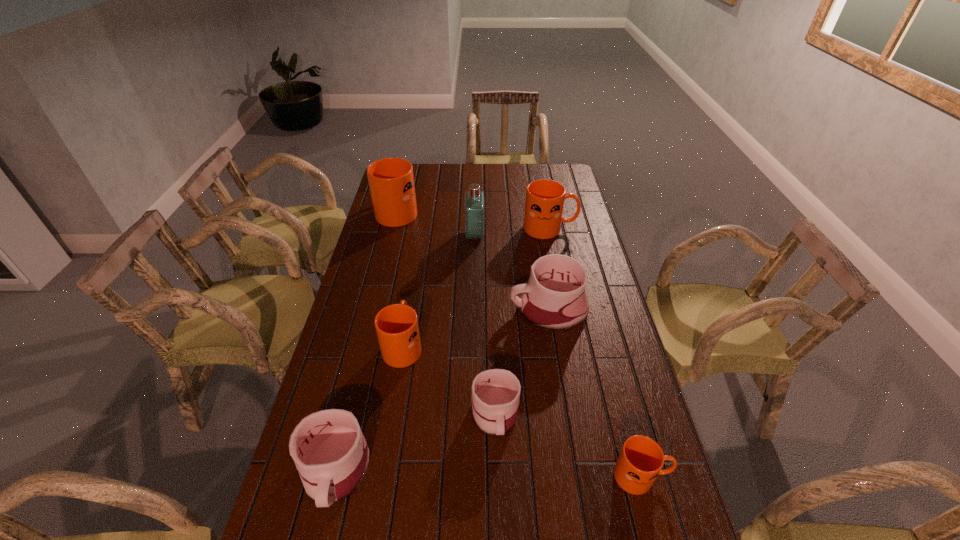
In order to click on vacant space situated 0.250m on the handle side of the biggest orange mug in this screenshot , I will do `click(408, 168)`.

You are a GUI agent. You are given a task and a screenshot of the screen. Output one action in this format:
    pyautogui.click(x=<x>, y=<y>)
    Task: Click on the free point located on the handle side of the biggest orange mug
    The height and width of the screenshot is (540, 960).
    Given the screenshot: What is the action you would take?
    pyautogui.click(x=407, y=172)

What are the coordinates of `vacant point located 0.130m on the handle side of the biggest orange mug` in the screenshot? It's located at (405, 180).

Where is `vacant area situated on the side with the handle of the farthest white mug`? vacant area situated on the side with the handle of the farthest white mug is located at coordinates (420, 308).

Find the location of a particular element. The image size is (960, 540). vacant space located 0.300m on the side with the handle of the farthest white mug is located at coordinates (422, 308).

You are a GUI agent. You are given a task and a screenshot of the screen. Output one action in this format:
    pyautogui.click(x=<x>, y=<y>)
    Task: Click on the free space located 0.290m on the side with the handle of the farthest white mug
    The image size is (960, 540).
    Given the screenshot: What is the action you would take?
    pyautogui.click(x=425, y=308)

You are a GUI agent. You are given a task and a screenshot of the screen. Output one action in this format:
    pyautogui.click(x=<x>, y=<y>)
    Task: Click on the vacant space situated 0.390m on the handle side of the second nearest orange mug
    The height and width of the screenshot is (540, 960).
    Given the screenshot: What is the action you would take?
    pyautogui.click(x=419, y=251)

You are a GUI agent. You are given a task and a screenshot of the screen. Output one action in this format:
    pyautogui.click(x=<x>, y=<y>)
    Task: Click on the vacant space located on the handle side of the second nearest orange mug
    
    Given the screenshot: What is the action you would take?
    pyautogui.click(x=415, y=272)

Find the location of a particular element. The width and height of the screenshot is (960, 540). vacant space situated on the handle side of the second nearest orange mug is located at coordinates (419, 249).

Image resolution: width=960 pixels, height=540 pixels. I want to click on vacant region located 0.080m on the side with the handle of the smallest white mug, so click(497, 475).